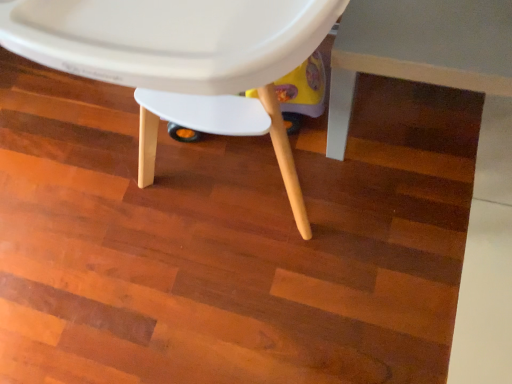
Where is `vacant area situated to the left side of white matte plastic chair at center`? The height and width of the screenshot is (384, 512). vacant area situated to the left side of white matte plastic chair at center is located at coordinates (73, 203).